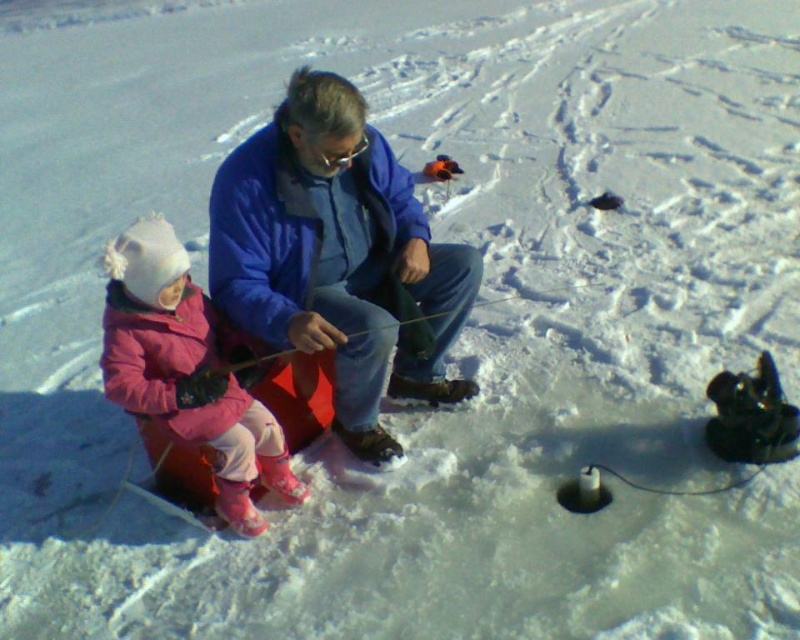
Who is more forward, (364, 310) or (180, 400)?

Point (180, 400) is in front.

What do you see at coordinates (337, 257) in the screenshot?
I see `blue fabric jacket at center` at bounding box center [337, 257].

Image resolution: width=800 pixels, height=640 pixels. I want to click on blue fabric jacket at center, so click(337, 257).